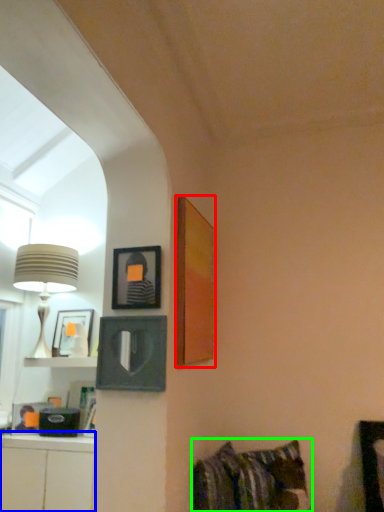
Question: Based on their relative distances, which object is nearer to picture frame (highlighted by a red box)? Choose from cabinetry (highlighted by a blue box) and bed (highlighted by a green box).

Choices:
 (A) cabinetry
 (B) bed

Answer: (B)